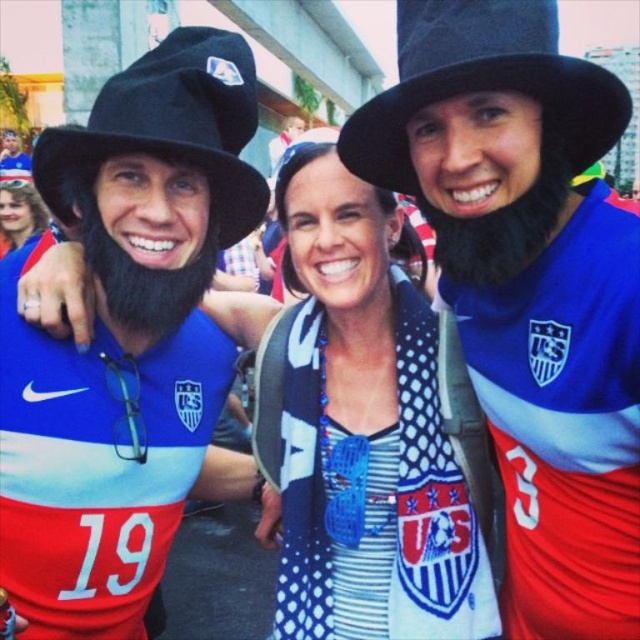
Who is more distant from viewer, (x=118, y=157) or (x=460, y=493)?

Positioned behind is point (x=460, y=493).

The image size is (640, 640). What do you see at coordinates (124, 337) in the screenshot? I see `matte black hat at upper left` at bounding box center [124, 337].

Identify the location of matte black hat at upper left. The width and height of the screenshot is (640, 640). (124, 337).

Does matte black hat at center have a smaller size compared to black felt hat at upper center?

Indeed, matte black hat at center has a smaller size compared to black felt hat at upper center.

Who is more distant from viewer, (x=464, y=198) or (x=522, y=1)?

Positioned behind is point (x=464, y=198).

Describe the element at coordinates (529, 288) in the screenshot. I see `matte black hat at center` at that location.

Image resolution: width=640 pixels, height=640 pixels. What are the coordinates of `matte black hat at center` in the screenshot? It's located at (529, 288).

Which is behind, point (145, 554) or point (483, 28)?

Positioned behind is point (145, 554).

Is point (150, 221) positioned after point (515, 8)?

Yes, point (150, 221) is farther from viewer.

Which is in front, point (156, 337) or point (552, 96)?

Point (552, 96)

The width and height of the screenshot is (640, 640). In order to click on matte black hat at upper left in this screenshot , I will do `click(124, 337)`.